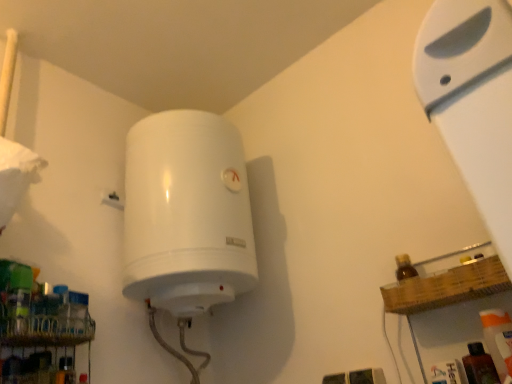
What do you see at coordinates (498, 339) in the screenshot? I see `translucent plastic spray bottle at lower right` at bounding box center [498, 339].

What do you see at coordinates (40, 330) in the screenshot?
I see `metallic wire rack at lower left` at bounding box center [40, 330].

Where is `translucent plastic spray bottle at lower right`? The height and width of the screenshot is (384, 512). translucent plastic spray bottle at lower right is located at coordinates (498, 339).

Would you say white plastic shelf at upper right is outside metallic wire rack at lower left?

white plastic shelf at upper right is positioned outside metallic wire rack at lower left.

From a real-world perspective, who is located higher, white plastic shelf at upper right or metallic wire rack at lower left?

white plastic shelf at upper right is physically above.

Between white plastic shelf at upper right and metallic wire rack at lower left, which one appears on the right side from the viewer's perspective?

Positioned to the right is white plastic shelf at upper right.

Considering the relative positions of white plastic shelf at upper right and metallic wire rack at lower left in the image provided, is white plastic shelf at upper right in front of metallic wire rack at lower left?

Yes, white plastic shelf at upper right is in front of metallic wire rack at lower left.

Between metallic wire rack at lower left and translucent plastic spray bottle at lower right, which one has larger width?

With larger width is translucent plastic spray bottle at lower right.

Measure the distance between metallic wire rack at lower left and translucent plastic spray bottle at lower right.

metallic wire rack at lower left is 36.03 inches away from translucent plastic spray bottle at lower right.

Which object is positioned more to the right, metallic wire rack at lower left or translucent plastic spray bottle at lower right?

translucent plastic spray bottle at lower right is more to the right.

Can you confirm if metallic wire rack at lower left is shorter than translucent plastic spray bottle at lower right?

Indeed, metallic wire rack at lower left has a lesser height compared to translucent plastic spray bottle at lower right.

From a real-world perspective, which object stands above the other?

white plastic shelf at upper right.

From the picture: Is white plastic shelf at upper right situated inside translucent plastic spray bottle at lower right or outside?

white plastic shelf at upper right lies outside translucent plastic spray bottle at lower right.

How different are the orientations of white plastic shelf at upper right and translucent plastic spray bottle at lower right in degrees?

They differ by 88.1 degrees in their facing directions.

This screenshot has width=512, height=384. Identify the location of wide above the translucent plastic spray bottle at lower right (from a real-world perspective). (473, 101).

Is translucent plastic spray bottle at lower right oriented away from white plastic shelf at upper right?

No, translucent plastic spray bottle at lower right is not facing away from white plastic shelf at upper right.

Can white plastic shelf at upper right be found inside translucent plastic spray bottle at lower right?

Definitely not — white plastic shelf at upper right is not inside translucent plastic spray bottle at lower right.

Does translucent plastic spray bottle at lower right appear on the left side of white plastic shelf at upper right?

No, translucent plastic spray bottle at lower right is not to the left of white plastic shelf at upper right.

In the scene shown: Is metallic wire rack at lower left further to camera compared to white plastic shelf at upper right?

Yes.

Does metallic wire rack at lower left have a larger size compared to white plastic shelf at upper right?

Incorrect, metallic wire rack at lower left is not larger than white plastic shelf at upper right.

This screenshot has height=384, width=512. I want to click on wide located in front of the metallic wire rack at lower left, so click(x=473, y=101).

Which object is wider, metallic wire rack at lower left or white plastic shelf at upper right?

metallic wire rack at lower left is wider.

Between translucent plastic spray bottle at lower right and metallic wire rack at lower left, which one is positioned in front?

translucent plastic spray bottle at lower right is in front.

Considering the relative sizes of translucent plastic spray bottle at lower right and metallic wire rack at lower left in the image provided, is translucent plastic spray bottle at lower right thinner than metallic wire rack at lower left?

In fact, translucent plastic spray bottle at lower right might be wider than metallic wire rack at lower left.

Where is `cleaning product in front of the metallic wire rack at lower left`? cleaning product in front of the metallic wire rack at lower left is located at coordinates (498, 339).

Locate an element on the screen. The image size is (512, 384). shelf below the white plastic shelf at upper right (from a real-world perspective) is located at coordinates (40, 330).

Find the location of `cleaning product lying above the metallic wire rack at lower left (from the image's perspective)`. cleaning product lying above the metallic wire rack at lower left (from the image's perspective) is located at coordinates (498, 339).

Looking at this image, from the image, which object appears to be farther from translucent plastic spray bottle at lower right, metallic wire rack at lower left or white plastic shelf at upper right?

The object further to translucent plastic spray bottle at lower right is metallic wire rack at lower left.

Estimate the real-world distances between objects in this image. Which object is closer to white plastic shelf at upper right, translucent plastic spray bottle at lower right or metallic wire rack at lower left?

translucent plastic spray bottle at lower right is closer to white plastic shelf at upper right.

Estimate the real-world distances between objects in this image. Which object is further from metallic wire rack at lower left, white plastic shelf at upper right or translucent plastic spray bottle at lower right?

The object further to metallic wire rack at lower left is white plastic shelf at upper right.

Estimate the real-world distances between objects in this image. Which object is closer to metallic wire rack at lower left, translucent plastic spray bottle at lower right or white plastic shelf at upper right?

Based on the image, translucent plastic spray bottle at lower right appears to be nearer to metallic wire rack at lower left.

Based on their spatial positions, is metallic wire rack at lower left or translucent plastic spray bottle at lower right closer to white plastic shelf at upper right?

Among the two, translucent plastic spray bottle at lower right is located nearer to white plastic shelf at upper right.

Estimate the real-world distances between objects in this image. Which object is closer to translucent plastic spray bottle at lower right, white plastic shelf at upper right or metallic wire rack at lower left?

white plastic shelf at upper right.

Find the location of a particular element. This screenshot has height=384, width=512. wide between metallic wire rack at lower left and translucent plastic spray bottle at lower right from left to right is located at coordinates (473, 101).